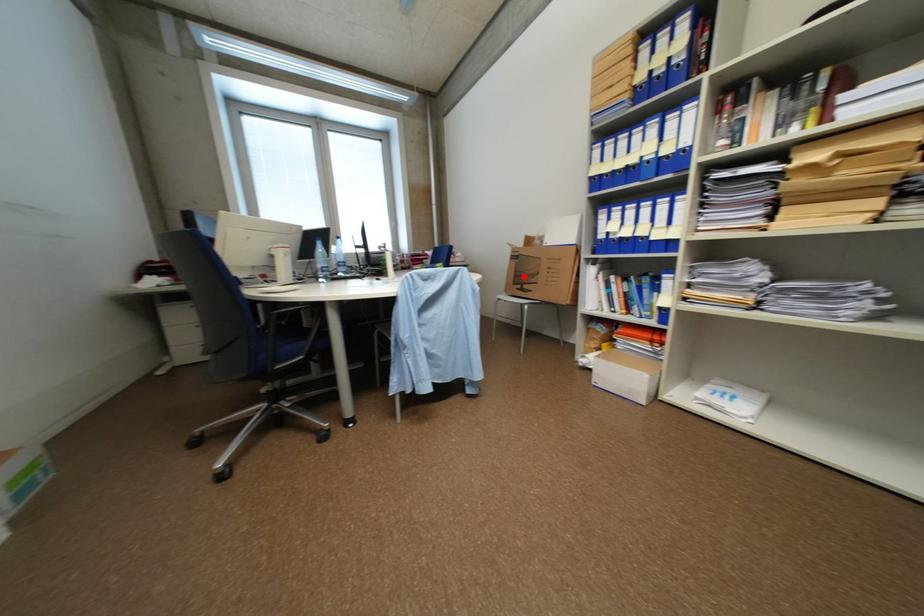
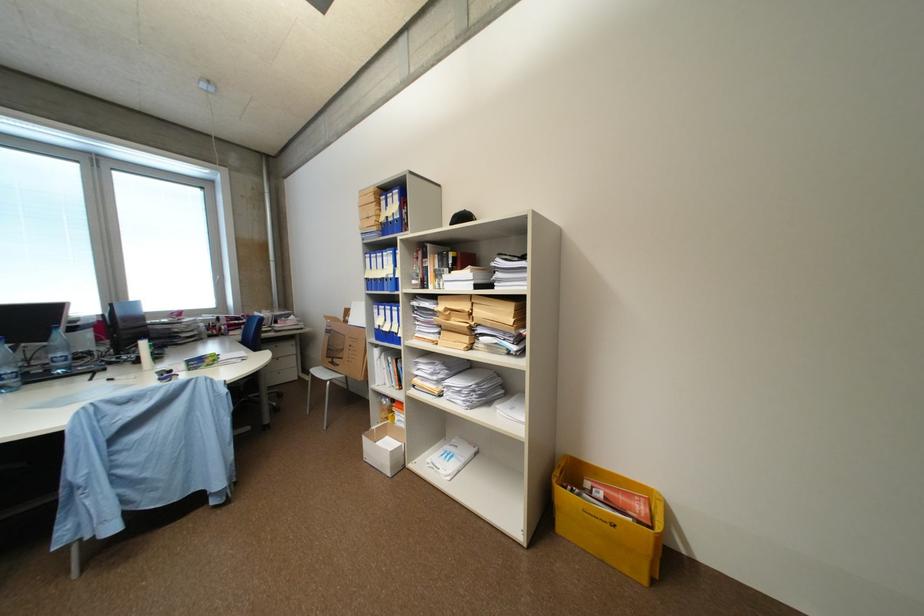
Question: I am providing you with two images of the same scene from different viewpoints. Given a red point in image1, look at the same physical point in image2. Is it:

Choices:
 (A) Closer to the viewpoint
 (B) Farther from the viewpoint

Answer: (B)